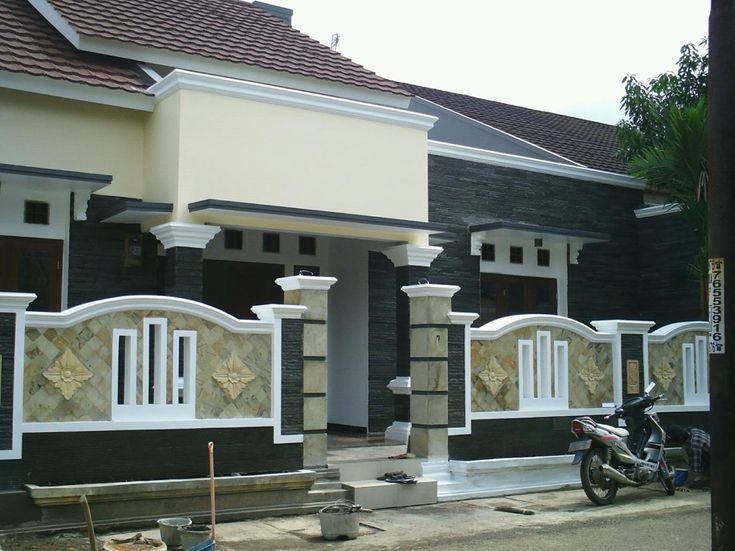
In order to click on gray bucket in this screenshot , I will do `click(190, 536)`.